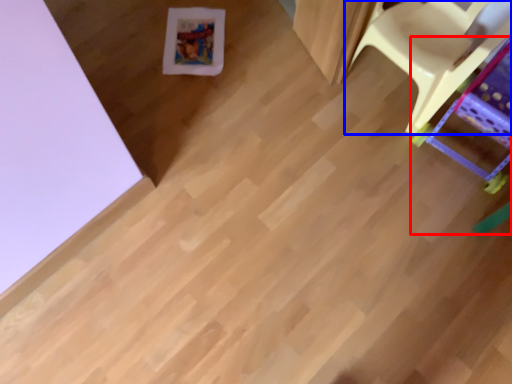
Question: Which object appears closest to the camera in this image, furniture (highlighted by a red box) or furniture (highlighted by a blue box)?

Choices:
 (A) furniture
 (B) furniture

Answer: (A)